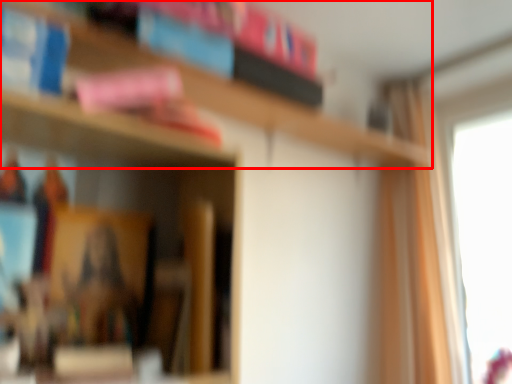
Question: From the image's perspective, considering the relative positions of bookcase (annotated by the red box) and curtain in the image provided, where is bookcase (annotated by the red box) located with respect to the staircase?

Choices:
 (A) below
 (B) above

Answer: (B)